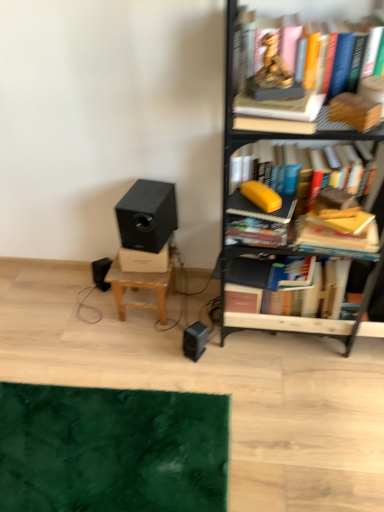
The width and height of the screenshot is (384, 512). I want to click on unoccupied region to the right of wooden stool at lower center, so click(x=201, y=305).